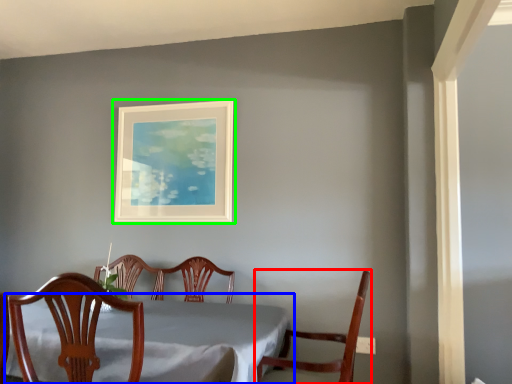
Question: Which object is positioned closest to chair (highlighted by a red box)? Select from table (highlighted by a blue box) and picture frame (highlighted by a green box).

Choices:
 (A) table
 (B) picture frame

Answer: (A)